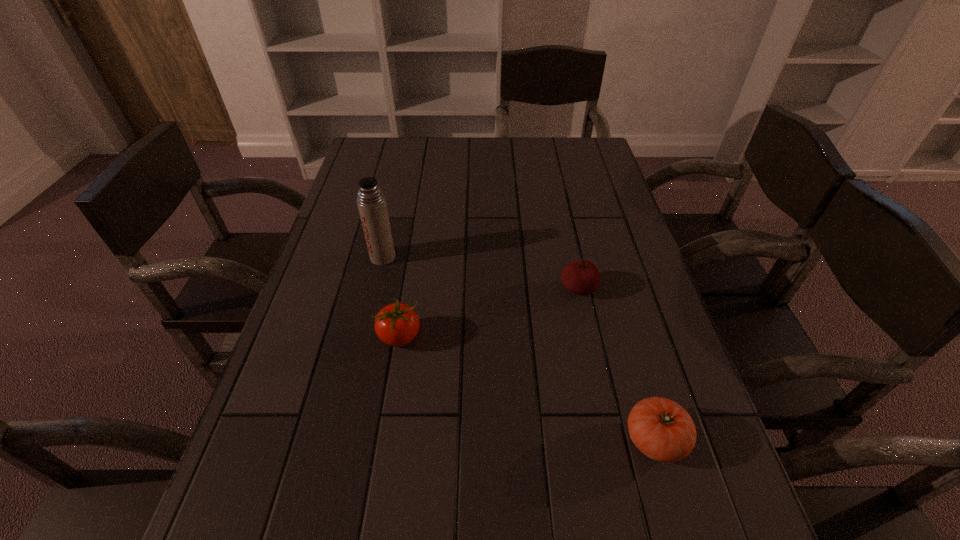
Where is `the farthest object`? This screenshot has height=540, width=960. the farthest object is located at coordinates point(371,202).

Find the location of a particular element. This screenshot has width=960, height=540. thermos bottle is located at coordinates (371, 202).

Locate an element on the screen. the leftmost tomato is located at coordinates (397, 324).

Identify the location of the second nearest tomato. (397, 324).

At what (x,y) coordinates should I click in order to perform the action: click on the farthest tomato. Please return your answer as a coordinate pair (x, y). This screenshot has height=540, width=960. Looking at the image, I should click on (582, 277).

Find the location of `the nearest tomato`. the nearest tomato is located at coordinates (661, 429).

Identify the location of vacant space located 0.120m on the right of the tallest object. This screenshot has height=540, width=960. (441, 257).

Where is `vacant region located 0.230m on the right of the second nearest object`? The image size is (960, 540). vacant region located 0.230m on the right of the second nearest object is located at coordinates (527, 337).

This screenshot has height=540, width=960. Find the location of `free space located 0.380m on the front of the farthest tomato`. free space located 0.380m on the front of the farthest tomato is located at coordinates (616, 463).

This screenshot has height=540, width=960. I want to click on vacant space located 0.140m on the left of the nearest tomato, so click(x=547, y=440).